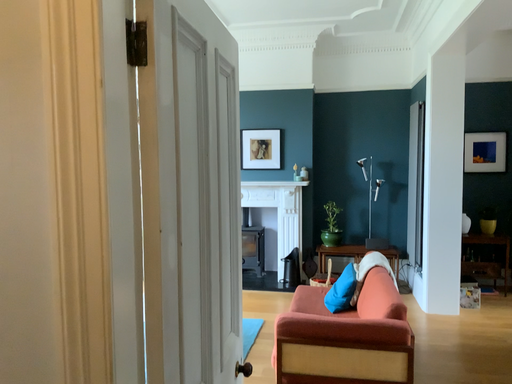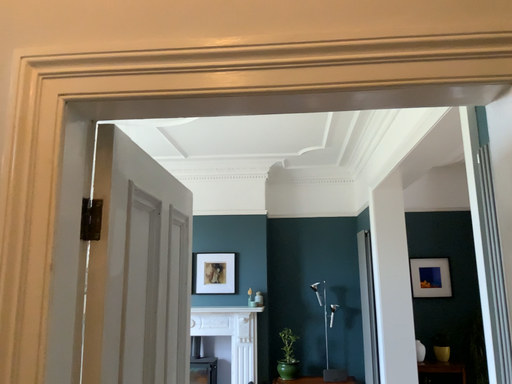
Question: Which way did the camera rotate in the video?

Choices:
 (A) rotated upward
 (B) rotated downward

Answer: (A)